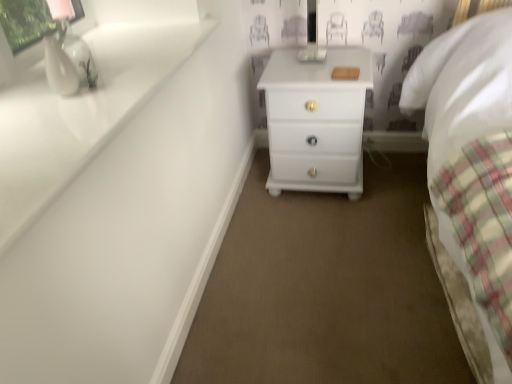
You are a GUI agent. You are given a task and a screenshot of the screen. Output one action in this format:
    pyautogui.click(x=<x>, y=<y>)
    Task: Click on the vacant space behind white glossy vase at upper left
    The width and height of the screenshot is (512, 384).
    Given the screenshot: What is the action you would take?
    coord(116,63)